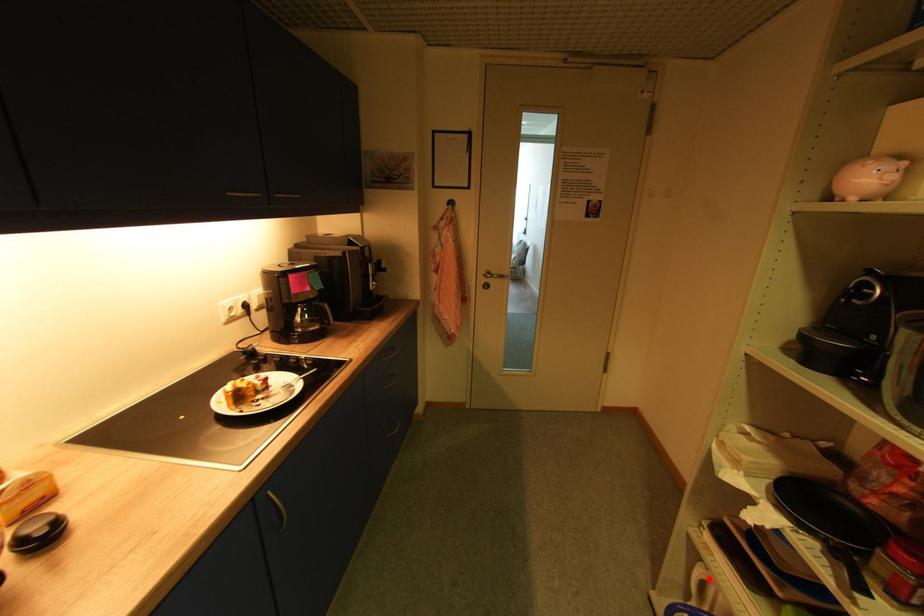
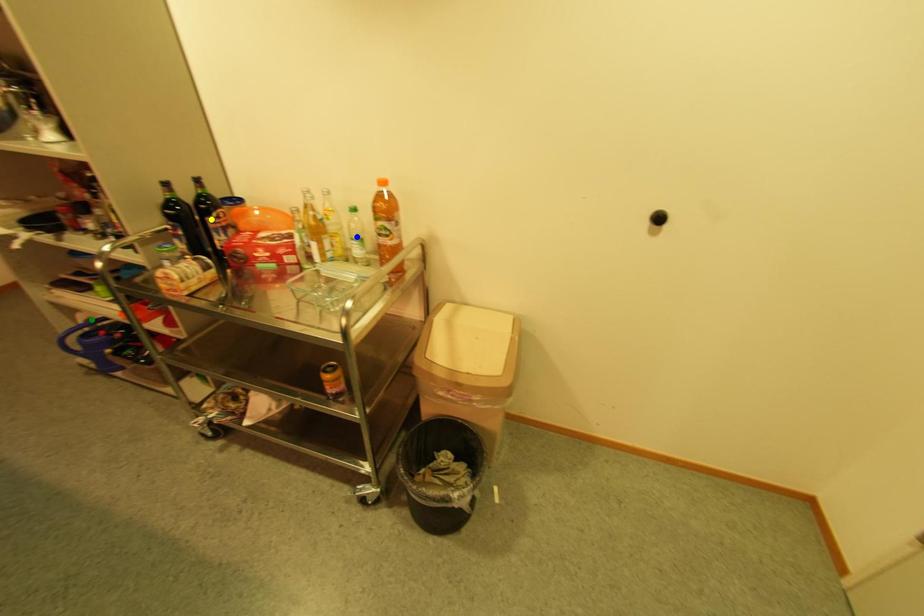
Question: I am providing you with two images of the same scene from different viewpoints. A red point is marked on the first image. You are given multiple points on the second image. In image 2, which mark is for the same physical point as the one in image 1?

Choices:
 (A) green point
 (B) yellow point
 (C) blue point

Answer: (A)